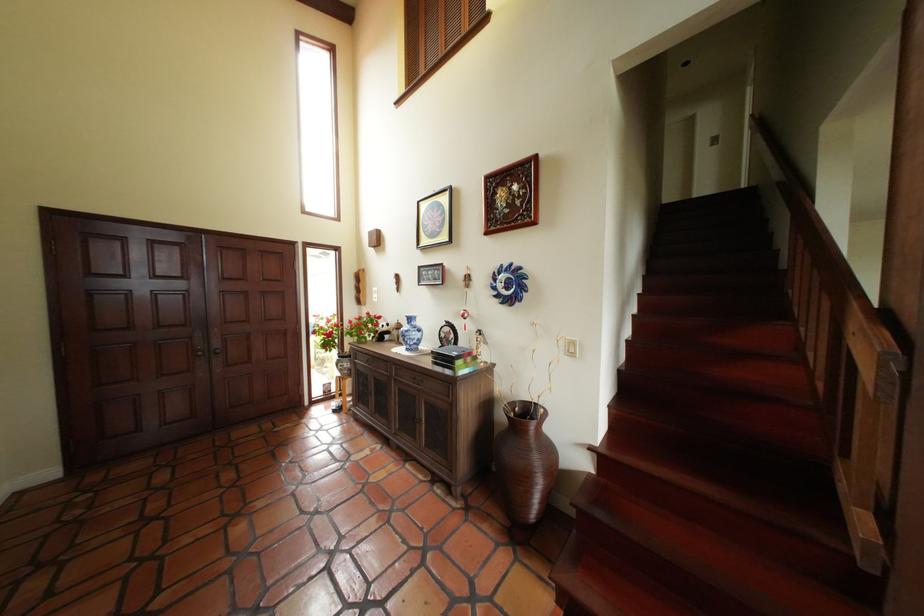
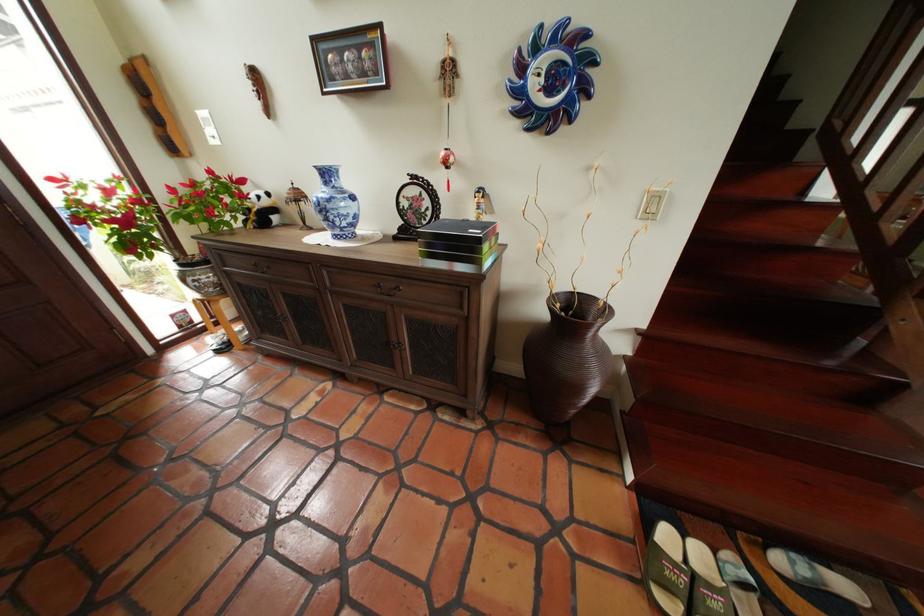
Locate, in the second image, the point that corresponds to [380,363] in the first image.

(266, 269)